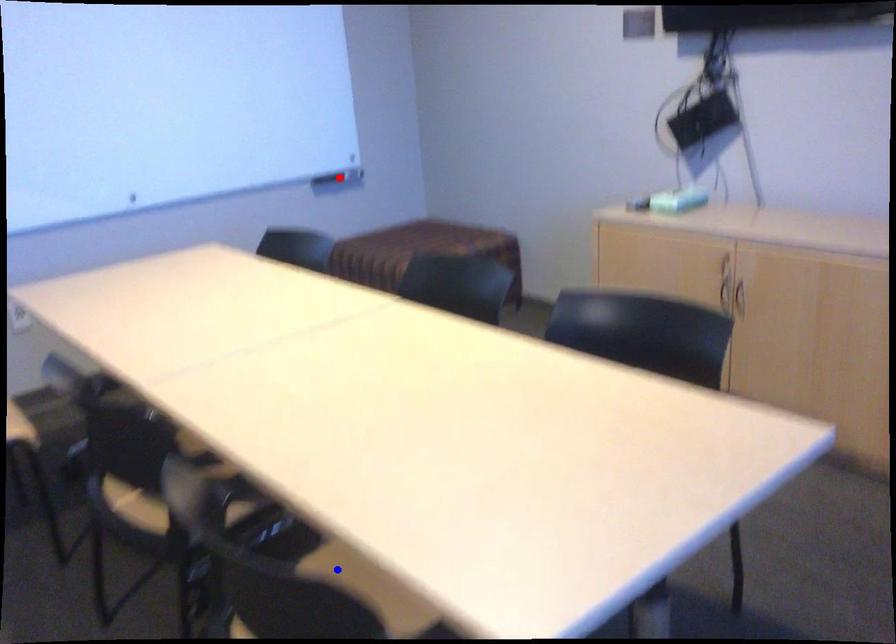
Question: Which of the two points in the image is closer to the camera?

Choices:
 (A) Blue point is closer.
 (B) Red point is closer.

Answer: (A)